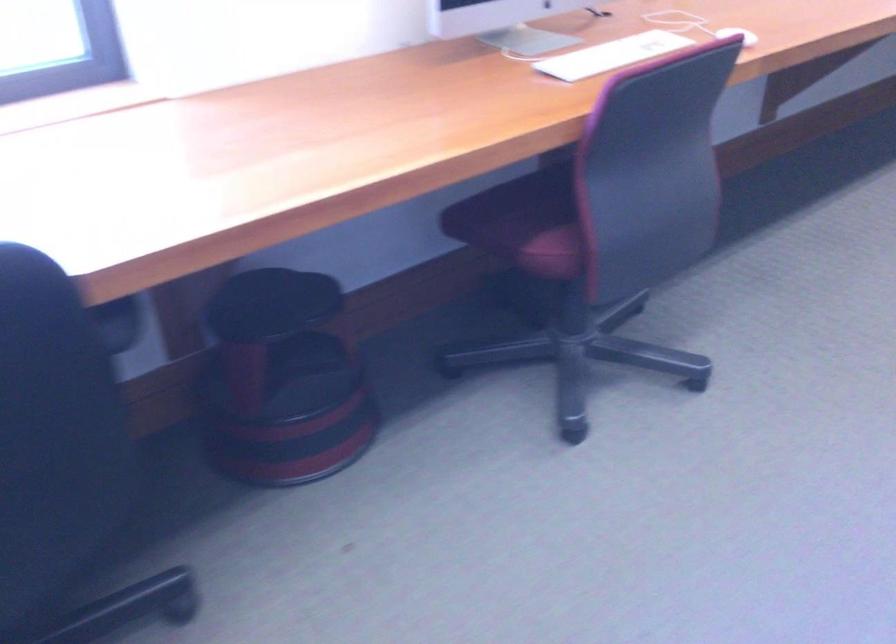
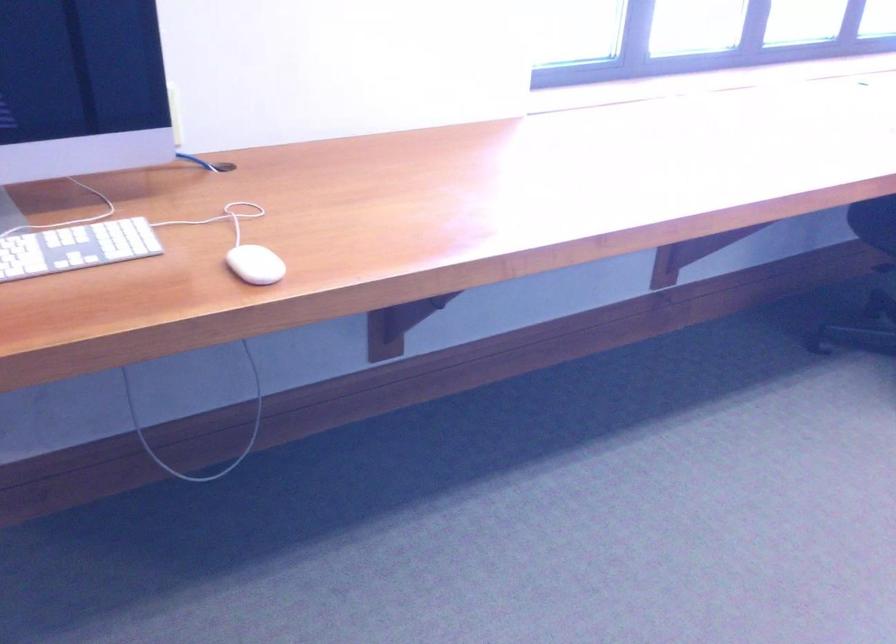
The images are taken continuously from a first-person perspective. In which direction are you moving?

The cameraman moved toward left, backward.